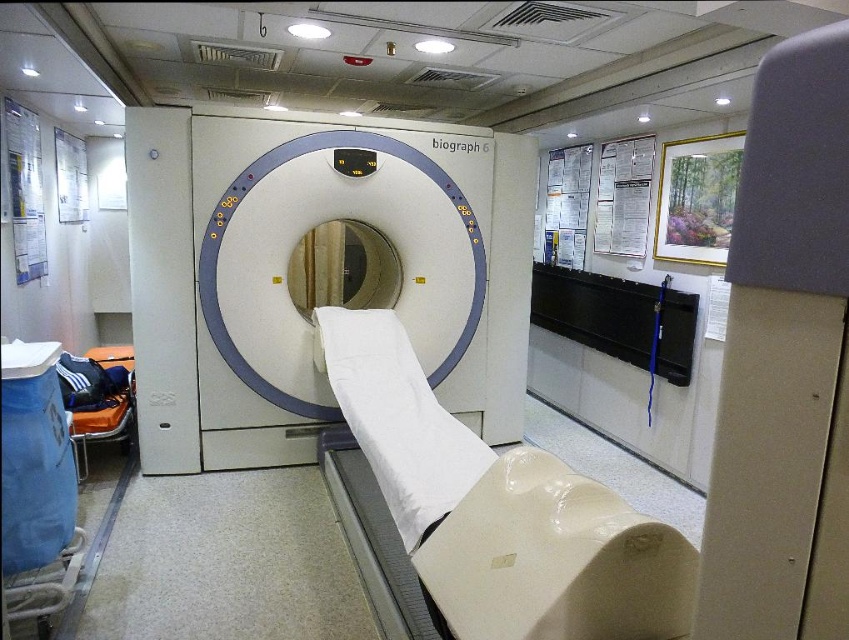
Question: Is white plastic biograph 6 at center to the right of white matte bed at center from the viewer's perspective?

Choices:
 (A) yes
 (B) no

Answer: (B)

Question: Which point is farther to the camera?

Choices:
 (A) white plastic biograph 6 at center
 (B) white matte bed at center

Answer: (A)

Question: Does white plastic biograph 6 at center appear over white matte bed at center?

Choices:
 (A) yes
 (B) no

Answer: (A)

Question: Which point is closer to the camera taking this photo?

Choices:
 (A) (448, 579)
 (B) (442, 342)

Answer: (A)

Question: Which of the following is the farthest from the observer?

Choices:
 (A) (644, 522)
 (B) (167, 132)

Answer: (B)

Question: Does white plastic biograph 6 at center appear over white matte bed at center?

Choices:
 (A) no
 (B) yes

Answer: (B)